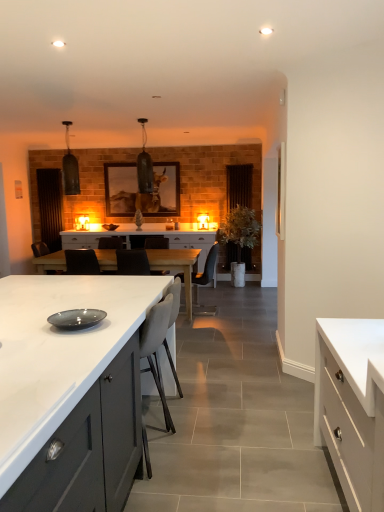
What are the coordinates of `free space to the back side of matte gray plate at center` in the screenshot? It's located at (109, 308).